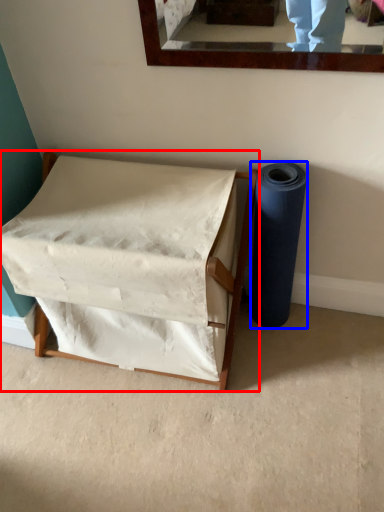
Question: Among these objects, which one is farthest to the camera, furniture (highlighted by a red box) or toilet paper (highlighted by a blue box)?

Choices:
 (A) furniture
 (B) toilet paper

Answer: (B)